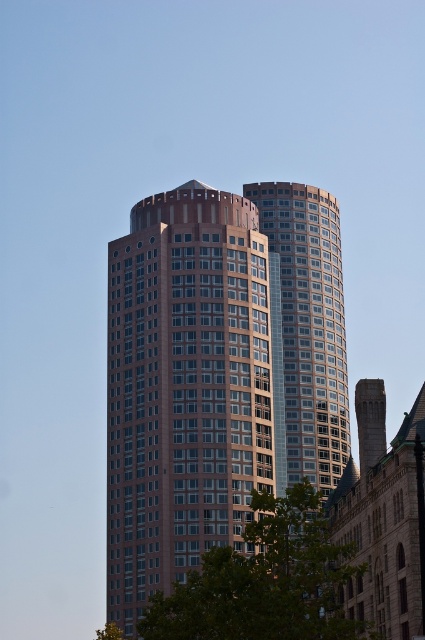
Looking at this image, you are standing in front of the two skyscrapers and want to take a photo that includes both points marked as point (329,492) and point (170,600). Which point will appear closer to the camera in your photo?

Point (329,492) is further to the viewer than point (170,600), so in the photo, point (329,492) will appear closer to the camera than point (170,600).

You are an architect evaluating the spatial compatibility of the shiny glass building at right and the green leafy tree at lower center. Based on their widths, which one would require more horizontal space if both were to be placed side by side without overlapping?

The green leafy tree at lower center requires more horizontal space because it has a greater width than the shiny glass building at right.